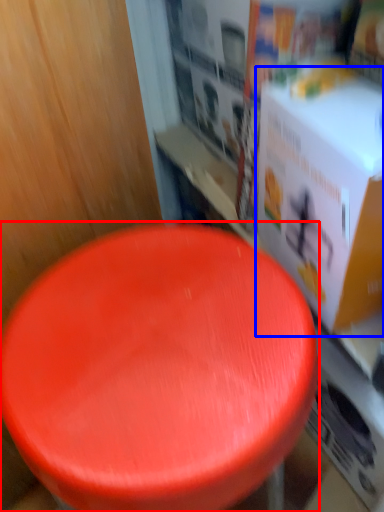
Question: Which of the following is the farthest to the observer, stool (highlighted by a red box) or box (highlighted by a blue box)?

Choices:
 (A) stool
 (B) box

Answer: (B)